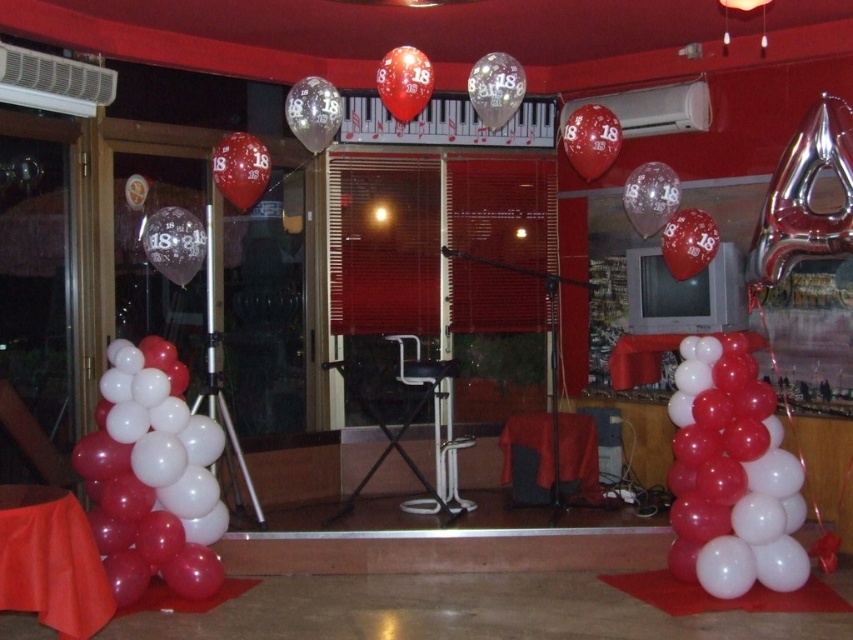
Question: Can you confirm if shiny metallic balloon at upper right is wider than transparent plastic balloon at upper center?

Choices:
 (A) yes
 (B) no

Answer: (B)

Question: Which object appears farthest from the camera in this image?

Choices:
 (A) transparent glittery balloon at upper center
 (B) white glossy balloons at lower right

Answer: (B)

Question: Considering the real-world distances, which object is closest to the transparent glittery balloon at upper center?

Choices:
 (A) shiny metallic balloon at center
 (B) white glossy balloons at lower right
 (C) transparent plastic balloon at upper center
 (D) white glossy balloons at left

Answer: (A)

Question: Where is white glossy balloons at left located in relation to transparent glittery balloon at upper center in the image?

Choices:
 (A) above
 (B) below

Answer: (B)

Question: Is white glossy balloons at lower right below transparent glossy balloon at center?

Choices:
 (A) yes
 (B) no

Answer: (A)

Question: Which object is the farthest from the shiny metallic balloon at center?

Choices:
 (A) shiny metallic balloon at upper right
 (B) transparent glittery balloon at upper center
 (C) transparent plastic balloon at upper center

Answer: (A)